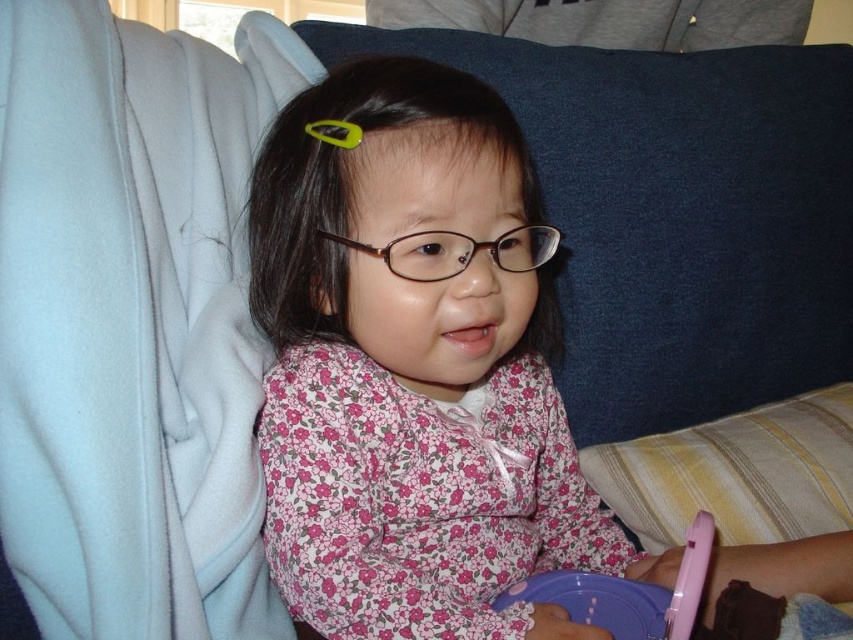
You are a photographer setting up for a family portrait. You need to position two lights at the coordinates point (421, 620) and point (585, 588). According to the scene, which light should be placed closer to the camera to ensure proper lighting?

Point (421, 620) should be placed closer to the camera because it is in front of point (585, 588), meaning it is nearer to the viewer.

The child is sitting on a couch with a blue backrest and a striped pillow. They are holding a purple object and wearing a pink floral dress. Where exactly is the point at coordinates (415, 364) located on the child?

The point at coordinates (415, 364) is located on the pink floral dress at center.